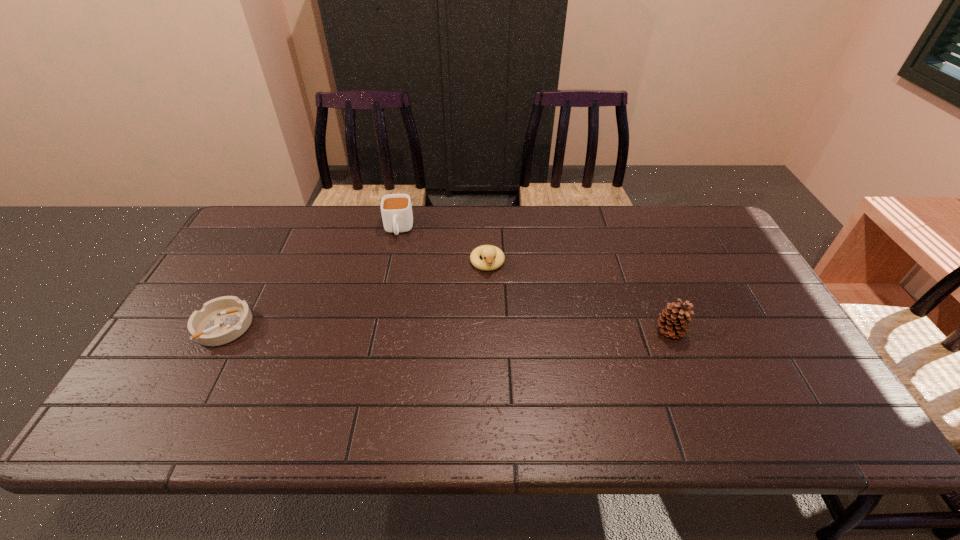
The width and height of the screenshot is (960, 540). Find the location of `vacant area that lies between the leftmost object and the cup`. vacant area that lies between the leftmost object and the cup is located at coordinates (311, 278).

Identify the location of vacant space in between the leftmost object and the cup. The image size is (960, 540). (311, 278).

Find the location of a particular element. vacant space in between the pinecone and the second farthest object is located at coordinates (579, 297).

Locate an element on the screen. Image resolution: width=960 pixels, height=540 pixels. object that can be found as the third closest to the third object from right to left is located at coordinates 673,319.

Select which object appears as the closest to the tallest object. Please provide its 2D coordinates. Your answer should be formatted as a tuple, i.e. [(x, y)], where the tuple contains the x and y coordinates of a point satisfying the conditions above.

[(493, 257)]

At what (x,y) coordinates should I click in order to perform the action: click on free region that satisfies the following two spatial constraints: 1. on the front side of the third object from left to right; 2. on the right side of the rightmost object. Please return your answer as a coordinate pair (x, y). This screenshot has width=960, height=540. Looking at the image, I should click on (489, 332).

Find the location of `free spot that satisfies the following two spatial constraints: 1. on the front side of the tallest object; 2. on the left side of the third tallest object`. free spot that satisfies the following two spatial constraints: 1. on the front side of the tallest object; 2. on the left side of the third tallest object is located at coordinates point(489,332).

Where is `free space in the image that satisfies the following two spatial constraints: 1. on the back side of the second farthest object; 2. on the left side of the shortest object`? free space in the image that satisfies the following two spatial constraints: 1. on the back side of the second farthest object; 2. on the left side of the shortest object is located at coordinates (258, 263).